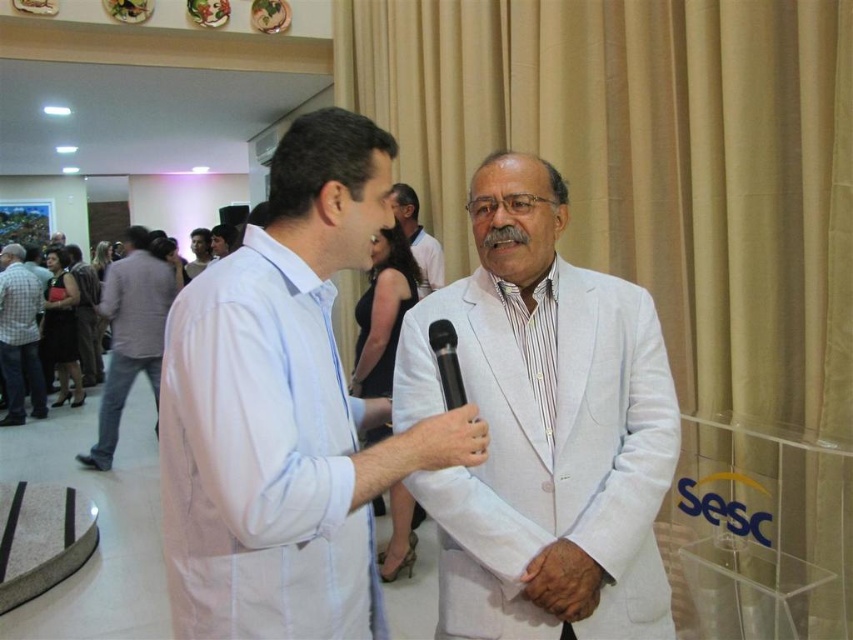
Can you confirm if gray checkered shirt at left is taller than light brown leather jacket at upper left?

Yes.

What do you see at coordinates (131, 333) in the screenshot? I see `gray checkered shirt at left` at bounding box center [131, 333].

Image resolution: width=853 pixels, height=640 pixels. In order to click on gray checkered shirt at left in this screenshot , I will do `click(131, 333)`.

Consider the image. Can you confirm if white textured suit at center is taller than light brown leather jacket at upper left?

Yes, white textured suit at center is taller than light brown leather jacket at upper left.

Does white textured suit at center have a greater width compared to light brown leather jacket at upper left?

No, white textured suit at center is not wider than light brown leather jacket at upper left.

Between point (399, 218) and point (195, 268), which one is positioned in front?

Point (399, 218) is in front.

I want to click on white textured suit at center, so click(418, 237).

Is checkered fabric shirt at left further to camera compared to white textured suit at center?

Yes.

Which is below, checkered fabric shirt at left or white textured suit at center?

checkered fabric shirt at left

What are the coordinates of `checkered fabric shirt at left` in the screenshot? It's located at (19, 337).

Identify the location of checkered fabric shirt at left. Image resolution: width=853 pixels, height=640 pixels. (19, 337).